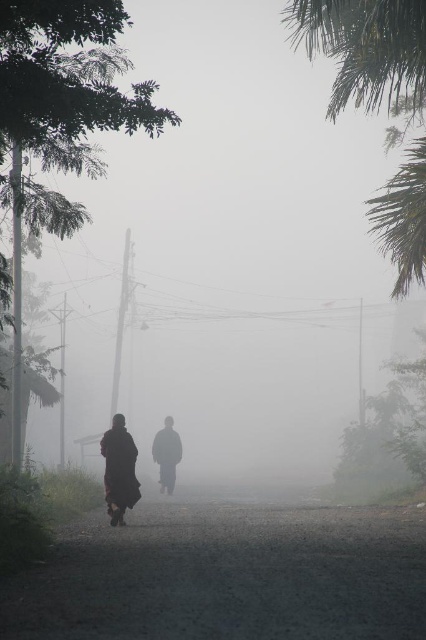
You are a hiker trying to navigate through the foggy area. You see the dark gravel road at center and the green leafy palm tree at upper right. Which object appears smaller in the image?

The dark gravel road at center appears smaller than the green leafy palm tree at upper right in the image.

You are standing on the foggy street and see a dark red robe at center. Where exactly is the dark red robe positioned in relation to the other elements in the scene?

The dark red robe at center is positioned at coordinates point (118, 468).